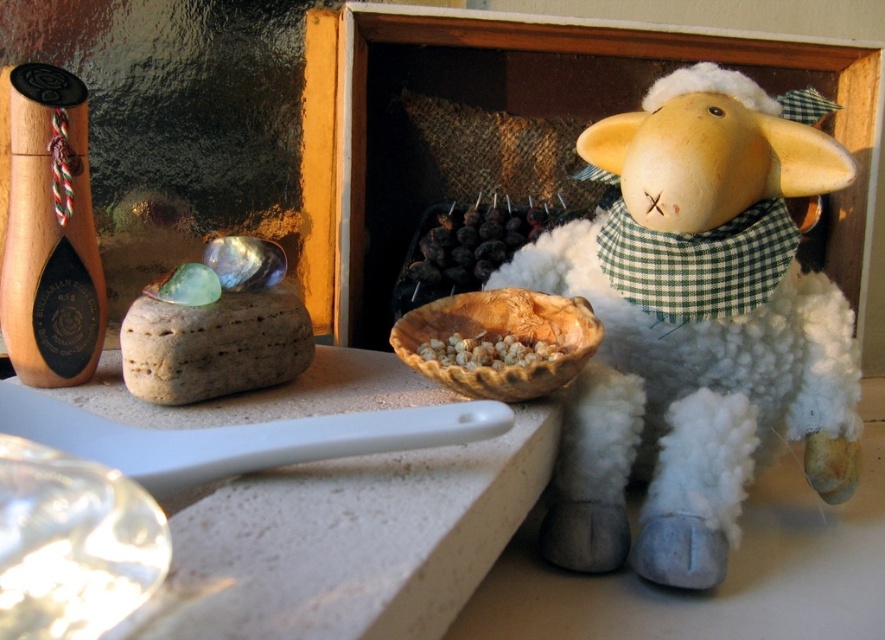
You have a small toy that is 12 inches long. You want to place it between the vintage pepper mill or grinder with dark label and decorative red and white string tied around its neck on the left and the white plush sheep at right. Can the toy fit in the space between them?

The distance between the vintage pepper mill or grinder with dark label and decorative red and white string tied around its neck on the left and the white plush sheep at right is 25.91 inches. Since the toy is only 12 inches long, it can easily fit in the space between them.

From the picture: You are organizing a rustic display on a shelf. You have a brown textured rock at left and a brown grainy bowl at center. Which object should you place closer to the back of the shelf to avoid blocking the view of the smaller one?

The brown textured rock at left is taller than the brown grainy bowl at center, so place the brown textured rock at left closer to the back of the shelf to avoid blocking the view of the smaller one.